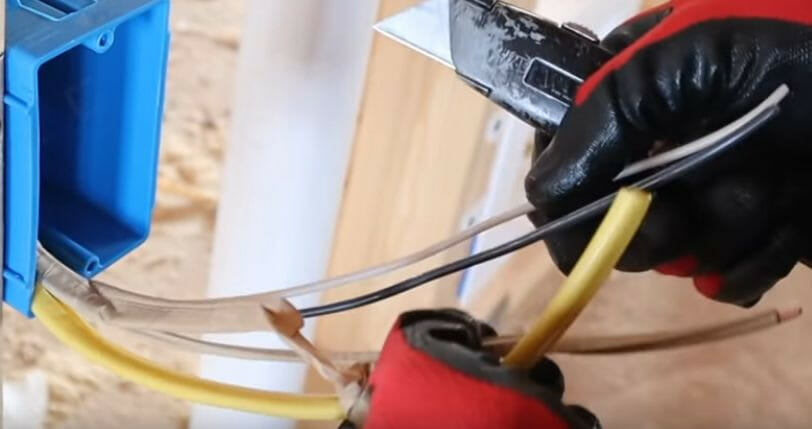
The height and width of the screenshot is (429, 812). Find the location of `screw hole`. screw hole is located at coordinates click(102, 42), click(91, 262).